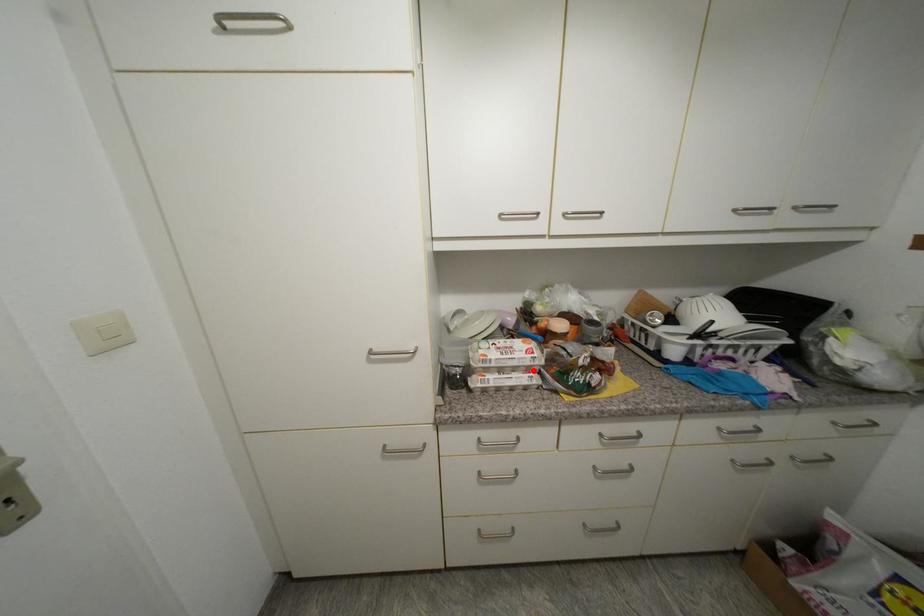
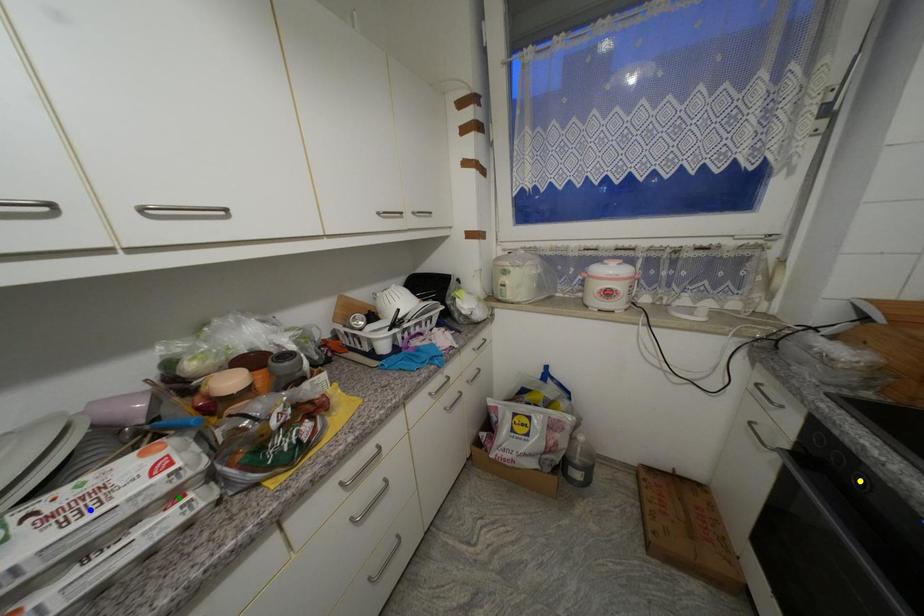
Question: I am providing you with two images of the same scene from different viewpoints. A red point is marked on the first image. You are given multiple points on the second image. Which spot in image 2 lines up with the point in image 1?

Choices:
 (A) yellow point
 (B) green point
 (C) blue point

Answer: (B)